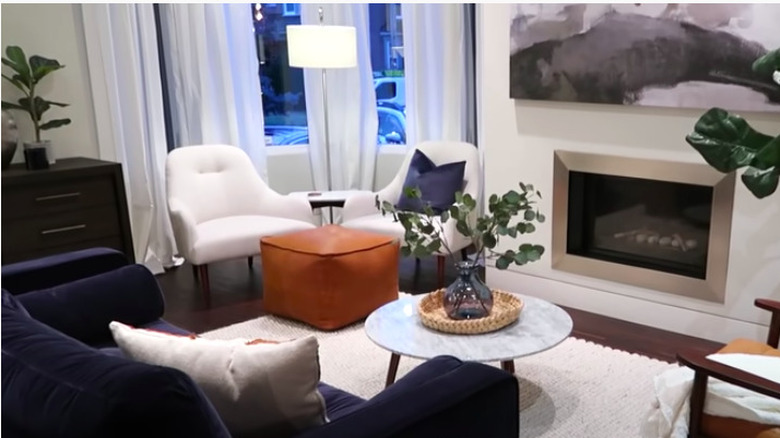
At what (x,y) coordinates should I click in order to perform the action: click on brown chair. Please return your answer as a coordinate pair (x, y). The image size is (780, 438). Looking at the image, I should click on (746, 342).